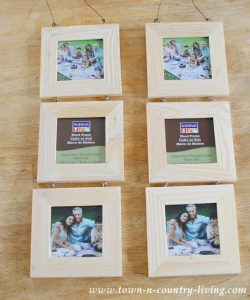
Find the location of `picture frame`. picture frame is located at coordinates (187, 194), (110, 163), (75, 192), (187, 110), (188, 85), (95, 87).